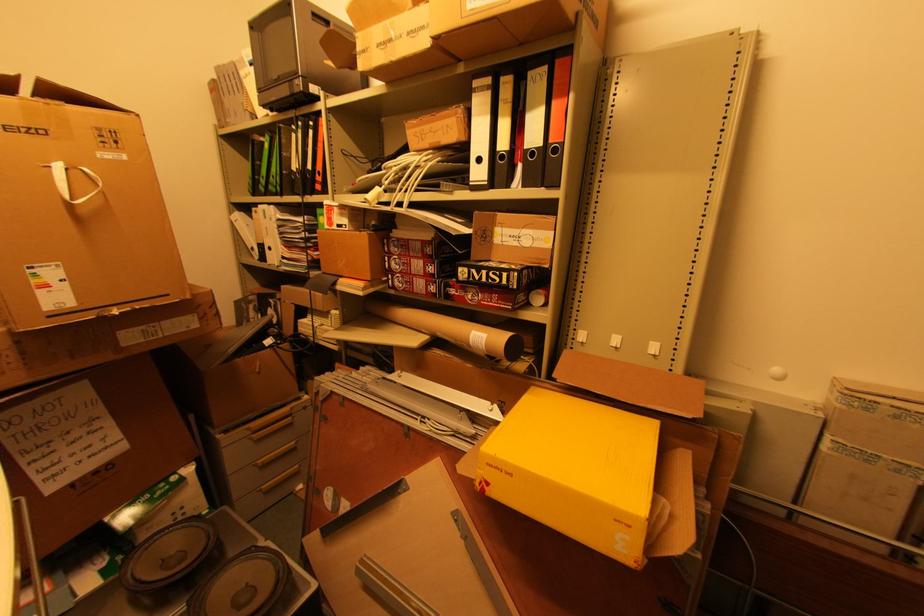
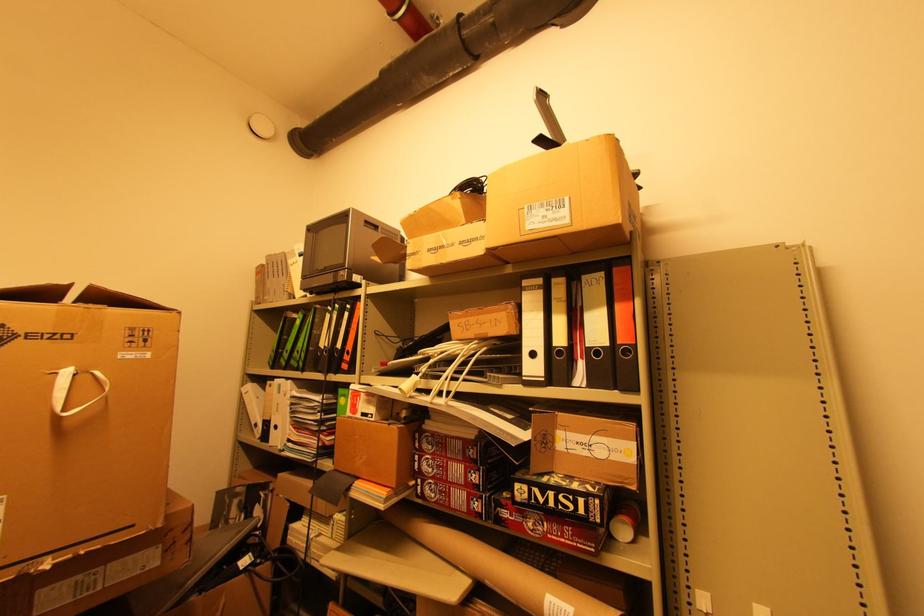
Locate, in the second image, the point that corresponds to [89,169] in the first image.

(101, 373)